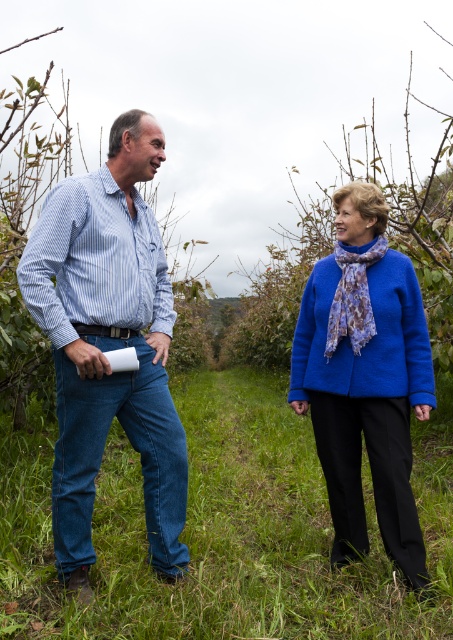
Locate an element on the screen. blue striped shirt at left is located at coordinates (109, 344).

Measure the distance between point (240, 336) and camera.

They are 19.88 meters apart.

Which is in front, point (437, 316) or point (328, 355)?

Positioned in front is point (328, 355).

Where is `blue woolen sweater at upper center`? blue woolen sweater at upper center is located at coordinates (417, 218).

Can you confirm if blue woolen sweater at center is taller than blue woolen jacket at center?

Indeed, blue woolen sweater at center has a greater height compared to blue woolen jacket at center.

Who is more forward, [167,572] or [380,307]?

Point [167,572] is more forward.

Image resolution: width=453 pixels, height=640 pixels. What do you see at coordinates (109, 344) in the screenshot? I see `blue woolen sweater at center` at bounding box center [109, 344].

Find the location of a particular element. The width and height of the screenshot is (453, 640). blue woolen sweater at center is located at coordinates (109, 344).